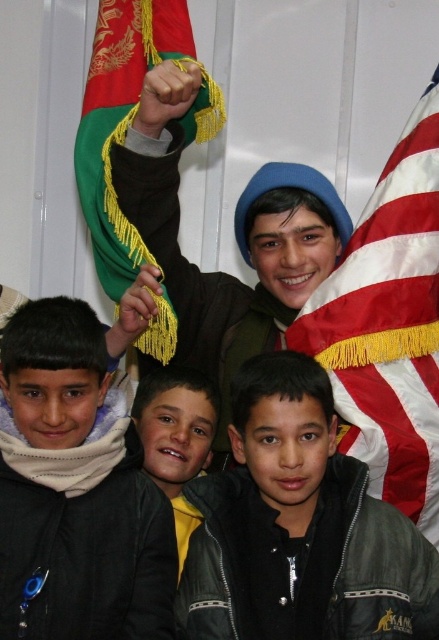
You are a photographer trying to capture a closeup of the national emblem on the green and red flag. You notice two points marked in the image. Which point, point (434, 540) or point (96, 260), is closer to the camera and thus better for focusing on the emblem?

Point (434, 540) is closer to the camera than point (96, 260), so it is better for focusing on the emblem.

You are a photographer adjusting your camera to focus on the american flag at right and the green fabric flag at upper left. Which flag should you focus on first to ensure it appears larger in the photo?

The american flag at right is closer to the viewer than the green fabric flag at upper left, so focusing on it first will make it appear larger in the photo.